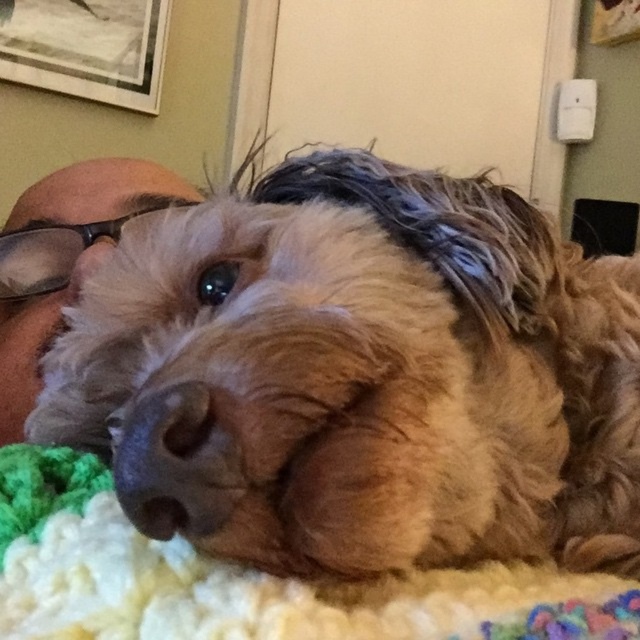
Based on the photo, who is positioned more to the right, knitted wool blanket at lower center or brown fur at upper left?

Positioned to the right is knitted wool blanket at lower center.

Which is in front, point (6, 456) or point (26, 365)?

Point (6, 456) is more forward.

In order to click on knitted wool blanket at lower center in this screenshot , I will do `click(248, 580)`.

Measure the distance from brown fluffy dog at center to knitted wool blanket at lower center.

brown fluffy dog at center and knitted wool blanket at lower center are 3.24 inches apart from each other.

Is brown fluffy dog at center above knitted wool blanket at lower center?

Yes, brown fluffy dog at center is above knitted wool blanket at lower center.

Which is in front, point (493, 490) or point (360, 621)?

Point (360, 621)

This screenshot has height=640, width=640. I want to click on brown fluffy dog at center, so click(360, 376).

Looking at this image, does brown fluffy dog at center appear on the right side of brown fur at upper left?

Correct, you'll find brown fluffy dog at center to the right of brown fur at upper left.

Who is positioned more to the left, brown fluffy dog at center or brown fur at upper left?

brown fur at upper left

Where is `brown fluffy dog at center`? brown fluffy dog at center is located at coordinates (360, 376).